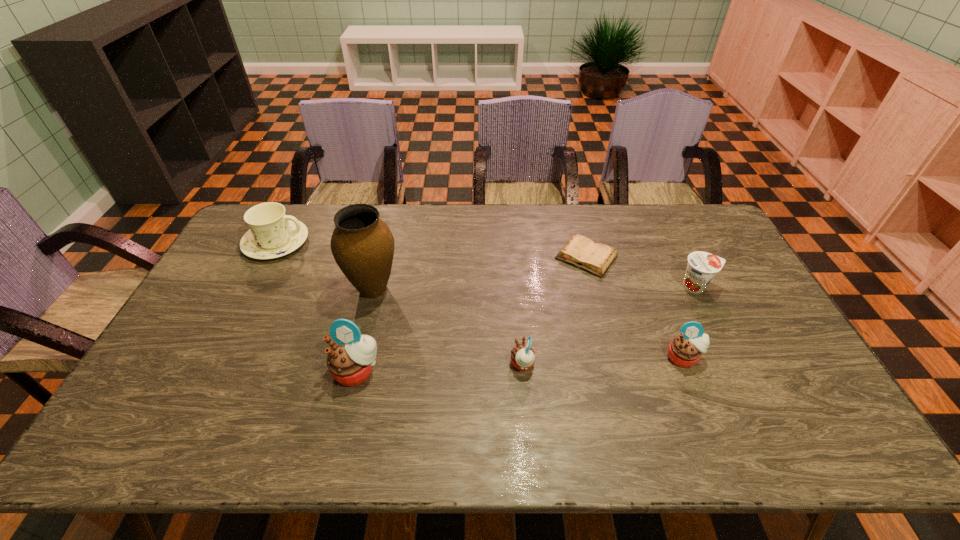
Locate an element on the screen. yogurt is located at coordinates (702, 266).

You are a GUI agent. You are given a task and a screenshot of the screen. Output one action in this format:
    pyautogui.click(x=<x>, y=<y>)
    Task: Click on the free space located 0.170m on the front-facing side of the shortest muffin
    Image resolution: width=960 pixels, height=540 pixels.
    Given the screenshot: What is the action you would take?
    pyautogui.click(x=446, y=364)

Find the location of a particular element. This screenshot has height=540, width=960. free space located 0.160m on the front-facing side of the shortest muffin is located at coordinates (450, 364).

Locate an element on the screen. This screenshot has height=540, width=960. free location located 0.230m on the front-facing side of the shortest muffin is located at coordinates (424, 364).

Where is `free space located 0.110m on the front-facing side of the second tallest muffin`? free space located 0.110m on the front-facing side of the second tallest muffin is located at coordinates point(704,408).

Where is `free space located 0.360m on the right of the tallest object`? This screenshot has height=540, width=960. free space located 0.360m on the right of the tallest object is located at coordinates (516, 289).

Find the location of a particular element. This screenshot has height=540, width=960. free location located 0.260m on the handle side of the chinaware is located at coordinates (383, 243).

Where is `free space located on the left of the diary`? free space located on the left of the diary is located at coordinates (510, 257).

The width and height of the screenshot is (960, 540). Find the location of `vacant region located 0.050m on the right of the rightmost object`. vacant region located 0.050m on the right of the rightmost object is located at coordinates (730, 287).

Find the location of a particular element. This screenshot has width=960, height=540. chinaware that is at the far edge is located at coordinates (272, 234).